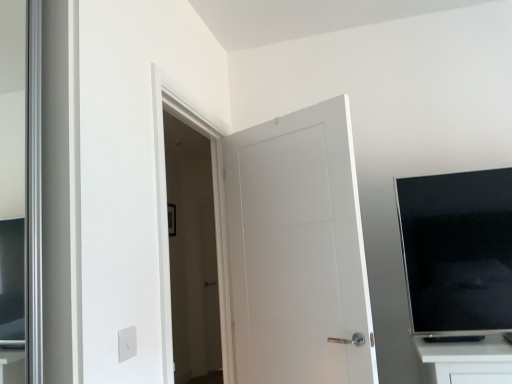
Where is `black glossy tv at upper right`? This screenshot has height=384, width=512. black glossy tv at upper right is located at coordinates (459, 272).

This screenshot has height=384, width=512. What do you see at coordinates (459, 272) in the screenshot? I see `black glossy tv at upper right` at bounding box center [459, 272].

Measure the distance between point (399,226) and camera.

6.73 feet.

Measure the distance between white matte door at center and camera.

A distance of 1.60 meters exists between white matte door at center and camera.

The image size is (512, 384). In order to click on white matte door at center in this screenshot , I will do `click(298, 251)`.

What is the approximate width of white matte door at center?

white matte door at center is 24.41 centimeters in width.

Image resolution: width=512 pixels, height=384 pixels. Describe the element at coordinates (298, 251) in the screenshot. I see `white matte door at center` at that location.

Image resolution: width=512 pixels, height=384 pixels. What are the coordinates of `black glossy tv at upper right` in the screenshot? It's located at (459, 272).

Is white matte door at center at the left side of black glossy tv at upper right?

Yes, white matte door at center is to the left of black glossy tv at upper right.

Based on the photo, which object is closer to the camera taking this photo, white matte door at center or black glossy tv at upper right?

Positioned in front is black glossy tv at upper right.

Is point (233, 290) farther from camera compared to point (410, 228)?

Yes, point (233, 290) is behind point (410, 228).

From the image's perspective, which one is positioned higher, white matte door at center or black glossy tv at upper right?

black glossy tv at upper right is shown above in the image.

From the picture: From a real-world perspective, is white matte door at center under black glossy tv at upper right?

No.

Which object is wider, white matte door at center or black glossy tv at upper right?

Wider between the two is white matte door at center.

Is white matte door at center taller than black glossy tv at upper right?

Indeed, white matte door at center has a greater height compared to black glossy tv at upper right.

Between white matte door at center and black glossy tv at upper right, which one has smaller size?

Smaller between the two is black glossy tv at upper right.

From the picture: Is black glossy tv at upper right a part of white matte door at center?

No, black glossy tv at upper right is not surrounded by white matte door at center.

Is white matte door at center touching black glossy tv at upper right?

No, white matte door at center is not in contact with black glossy tv at upper right.

Could you tell me if white matte door at center is facing black glossy tv at upper right?

No, white matte door at center is not facing towards black glossy tv at upper right.

Consider the image. How different are the orientations of white matte door at center and black glossy tv at upper right in degrees?

The angle between the facing direction of white matte door at center and the facing direction of black glossy tv at upper right is 31.6 degrees.

Locate an element on the screen. This screenshot has width=512, height=384. door below the black glossy tv at upper right (from the image's perspective) is located at coordinates pos(298,251).

Between black glossy tv at upper right and white matte door at center, which one appears on the right side from the viewer's perspective?

black glossy tv at upper right.

Does black glossy tv at upper right come behind white matte door at center?

No, black glossy tv at upper right is closer to the viewer.

Which point is more distant from viewer, (505, 192) or (266, 238)?

The point (266, 238) is farther.

From the image's perspective, which object appears higher, black glossy tv at upper right or white matte door at center?

black glossy tv at upper right is shown above in the image.

From a real-world perspective, does black glossy tv at upper right stand above white matte door at center?

No.

Is black glossy tv at upper right thinner than white matte door at center?

Yes.

Looking at this image, who is shorter, black glossy tv at upper right or white matte door at center?

black glossy tv at upper right.

Between black glossy tv at upper right and white matte door at center, which one has larger size?

white matte door at center.

Would you say black glossy tv at upper right contains white matte door at center?

No.

Is there a large distance between black glossy tv at upper right and white matte door at center?

No, black glossy tv at upper right is not far from white matte door at center.

Is black glossy tv at upper right turned away from white matte door at center?

No, black glossy tv at upper right is not facing away from white matte door at center.

Can you tell me how much black glossy tv at upper right and white matte door at center differ in facing direction?

31.6 degrees.

Locate an element on the screen. entertainment center above the white matte door at center (from the image's perspective) is located at coordinates (459, 272).

The width and height of the screenshot is (512, 384). Identify the location of door behind the black glossy tv at upper right. (298, 251).

This screenshot has height=384, width=512. In order to click on door below the black glossy tv at upper right (from the image's perspective) in this screenshot , I will do `click(298, 251)`.